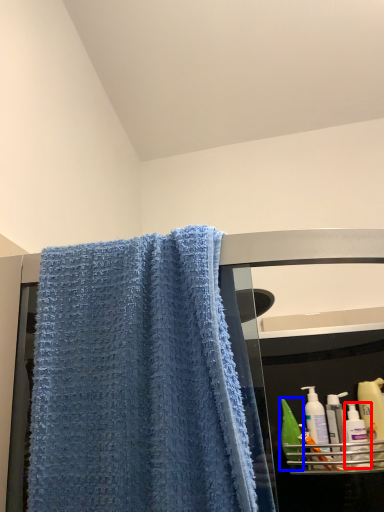
Question: Which object appears closest to the camera in this image, cleaning product (highlighted by a red box) or mouthwash (highlighted by a blue box)?

Choices:
 (A) cleaning product
 (B) mouthwash

Answer: (A)